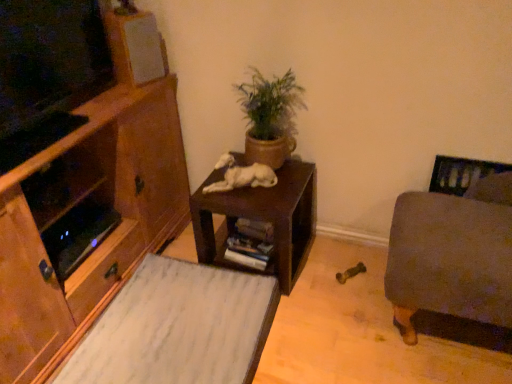
Where is `space that is in front of dark brown wood table at center`? The image size is (512, 384). space that is in front of dark brown wood table at center is located at coordinates (312, 324).